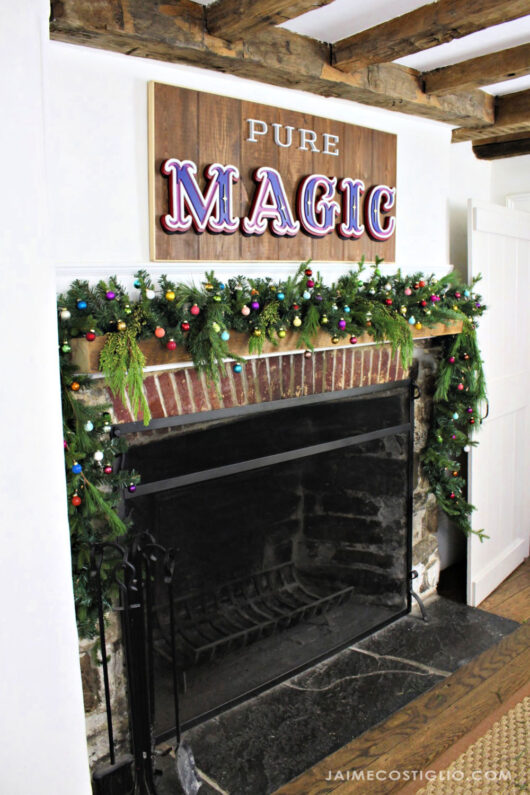
This screenshot has height=795, width=530. Find the location of `handmade wall sign`. handmade wall sign is located at coordinates (295, 165).